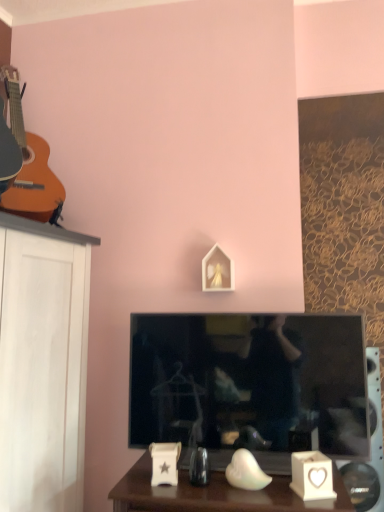
The width and height of the screenshot is (384, 512). What do you see at coordinates (371, 449) in the screenshot? I see `white plastic speaker at lower right` at bounding box center [371, 449].

At what (x,y) coordinates should I click in order to perform the action: click on white plastic speaker at lower right. Please return your answer as a coordinate pair (x, y). Looking at the image, I should click on (371, 449).

The width and height of the screenshot is (384, 512). Find the location of `white matte picture frame at center`. white matte picture frame at center is located at coordinates (217, 271).

Is white ceramic heart-shaped candle holder at lower right in front of or behind white plastic speaker at lower right in the image?

white ceramic heart-shaped candle holder at lower right is positioned closer to the viewer than white plastic speaker at lower right.

Does point (325, 481) come in front of point (372, 379)?

Yes, it is.

Is white ceramic heart-shaped candle holder at lower right oriented towards white plastic speaker at lower right?

No, white ceramic heart-shaped candle holder at lower right is not oriented towards white plastic speaker at lower right.

Which object is positioned more to the left, white ceramic heart-shaped candle holder at lower right or white plastic speaker at lower right?

Positioned to the left is white ceramic heart-shaped candle holder at lower right.

Looking at this image, is white matte picture frame at center thinner than matte orange acoustic guitar at left?

Correct, the width of white matte picture frame at center is less than that of matte orange acoustic guitar at left.

Considering the positions of objects white matte picture frame at center and matte orange acoustic guitar at left in the image provided, who is behind, white matte picture frame at center or matte orange acoustic guitar at left?

white matte picture frame at center is further from the camera.

From the picture: Is white matte picture frame at center next to matte orange acoustic guitar at left?

No, white matte picture frame at center is not touching matte orange acoustic guitar at left.

Considering the relative sizes of black glossy television at center and white plastic speaker at lower right in the image provided, is black glossy television at center wider than white plastic speaker at lower right?

No.

Is black glossy television at center outside of white plastic speaker at lower right?

Yes, black glossy television at center is outside of white plastic speaker at lower right.

Relative to white plastic speaker at lower right, is black glossy television at center in front or behind?

Visually, black glossy television at center is located in front of white plastic speaker at lower right.

Image resolution: width=384 pixels, height=512 pixels. I want to click on speaker that appears on the right of black glossy television at center, so click(371, 449).

Who is more distant, white matte picture frame at center or white plastic speaker at lower right?

Positioned behind is white plastic speaker at lower right.

Does white matte picture frame at center have a greater height compared to white plastic speaker at lower right?

In fact, white matte picture frame at center may be shorter than white plastic speaker at lower right.

From a real-world perspective, is white matte picture frame at center positioned above or below white plastic speaker at lower right?

Clearly, from a real-world perspective, white matte picture frame at center is above white plastic speaker at lower right.

How many degrees apart are the facing directions of white matte picture frame at center and white plastic speaker at lower right?

There is a 9.91-degree angle between the facing directions of white matte picture frame at center and white plastic speaker at lower right.

Is black glossy television at center inside the boundaries of matte orange acoustic guitar at left, or outside?

black glossy television at center lies outside matte orange acoustic guitar at left.

Is matte orange acoustic guitar at left at the back of black glossy television at center?

No, black glossy television at center is not facing away from matte orange acoustic guitar at left.

Does black glossy television at center come behind matte orange acoustic guitar at left?

That is True.

This screenshot has height=512, width=384. Identify the location of television below the matte orange acoustic guitar at left (from the image's perspective). click(250, 384).

How far apart are matte orange acoustic guitar at left and white plastic speaker at lower right?

matte orange acoustic guitar at left and white plastic speaker at lower right are 5.85 feet apart from each other.

Can you see matte orange acoustic guitar at left touching white plastic speaker at lower right?

No, matte orange acoustic guitar at left is not with white plastic speaker at lower right.

Can you confirm if matte orange acoustic guitar at left is shorter than white plastic speaker at lower right?

No.

From a real-world perspective, which is physically below, matte orange acoustic guitar at left or white plastic speaker at lower right?

From a 3D spatial view, white plastic speaker at lower right is below.

Could you tell me if black glossy television at center is turned towards white matte picture frame at center?

No, black glossy television at center is not turned towards white matte picture frame at center.

Measure the distance from black glossy television at center to white matte picture frame at center.

The distance of black glossy television at center from white matte picture frame at center is 18.94 inches.

Is black glossy television at center further to camera compared to white matte picture frame at center?

No, black glossy television at center is closer to the viewer.

From the image's perspective, which is above, black glossy television at center or white matte picture frame at center?

From the image's view, white matte picture frame at center is above.

In the image, there is a white ceramic heart-shaped candle holder at lower right. What are the coordinates of `speaker below it (from a real-world perspective)` in the screenshot? It's located at (371, 449).

You are a GUI agent. You are given a task and a screenshot of the screen. Output one action in this format:
    pyautogui.click(x=<x>, y=<y>)
    Task: Click on the picture frame behind the matte orange acoustic guitar at left
    Image resolution: width=384 pixels, height=512 pixels.
    Given the screenshot: What is the action you would take?
    pyautogui.click(x=217, y=271)

Considering their positions, is white matte picture frame at center positioned further to black glossy television at center than white ceramic heart-shaped candle holder at lower right?

Based on the image, white matte picture frame at center appears to be further to black glossy television at center.

Estimate the real-world distances between objects in this image. Which object is closer to matte orange acoustic guitar at left, black glossy television at center or white matte picture frame at center?

Among the two, white matte picture frame at center is located nearer to matte orange acoustic guitar at left.

Based on their spatial positions, is black glossy television at center or white matte picture frame at center closer to white ceramic heart-shaped candle holder at lower right?

Among the two, black glossy television at center is located nearer to white ceramic heart-shaped candle holder at lower right.

Considering their positions, is matte orange acoustic guitar at left positioned closer to black glossy television at center than white ceramic heart-shaped candle holder at lower right?

Based on the image, white ceramic heart-shaped candle holder at lower right appears to be nearer to black glossy television at center.

Looking at the image, which one is located further to black glossy television at center, white plastic speaker at lower right or white matte picture frame at center?

white plastic speaker at lower right is positioned further to the anchor black glossy television at center.

Based on their spatial positions, is matte orange acoustic guitar at left or white matte picture frame at center closer to white ceramic heart-shaped candle holder at lower right?

The object closer to white ceramic heart-shaped candle holder at lower right is white matte picture frame at center.

Looking at the image, which one is located closer to matte orange acoustic guitar at left, white matte picture frame at center or white ceramic heart-shaped candle holder at lower right?

The object closer to matte orange acoustic guitar at left is white matte picture frame at center.

Looking at the image, which one is located closer to matte orange acoustic guitar at left, black glossy television at center or white ceramic heart-shaped candle holder at lower right?

black glossy television at center.

Where is `picture frame between matte orange acoustic guitar at left and black glossy television at center vertically`? The width and height of the screenshot is (384, 512). picture frame between matte orange acoustic guitar at left and black glossy television at center vertically is located at coordinates (217, 271).

In order to click on candle holder between matte orange acoustic guitar at left and white plastic speaker at lower right from top to bottom in this screenshot , I will do `click(312, 476)`.

Where is `television between matte orange acoustic guitar at left and white ceramic heart-shaped candle holder at lower right from top to bottom`? The image size is (384, 512). television between matte orange acoustic guitar at left and white ceramic heart-shaped candle holder at lower right from top to bottom is located at coordinates (250, 384).

The image size is (384, 512). In order to click on candle holder between black glossy television at center and white plastic speaker at lower right from left to right in this screenshot , I will do `click(312, 476)`.